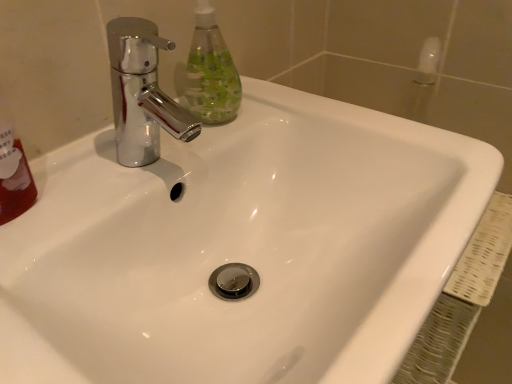
Question: Is clear plastic bottle at upper left thinner than chrome metallic faucet at upper left?

Choices:
 (A) yes
 (B) no

Answer: (A)

Question: From the image's perspective, is clear plastic bottle at upper left on chrome metallic faucet at upper left?

Choices:
 (A) yes
 (B) no

Answer: (A)

Question: Is clear plastic bottle at upper left in front of chrome metallic faucet at upper left?

Choices:
 (A) yes
 (B) no

Answer: (B)

Question: Does clear plastic bottle at upper left have a smaller size compared to chrome metallic faucet at upper left?

Choices:
 (A) no
 (B) yes

Answer: (B)

Question: From a real-world perspective, does clear plastic bottle at upper left sit lower than chrome metallic faucet at upper left?

Choices:
 (A) no
 (B) yes

Answer: (A)

Question: From the image's perspective, does clear plastic bottle at upper left appear lower than chrome metallic faucet at upper left?

Choices:
 (A) yes
 (B) no

Answer: (B)

Question: Is chrome metallic faucet at upper left further to the viewer compared to clear plastic bottle at upper left?

Choices:
 (A) no
 (B) yes

Answer: (A)

Question: Considering the relative positions of chrome metallic faucet at upper left and clear plastic bottle at upper left in the image provided, is chrome metallic faucet at upper left in front of clear plastic bottle at upper left?

Choices:
 (A) no
 (B) yes

Answer: (B)

Question: From a real-world perspective, does chrome metallic faucet at upper left stand above clear plastic bottle at upper left?

Choices:
 (A) no
 (B) yes

Answer: (A)

Question: Is chrome metallic faucet at upper left located outside clear plastic bottle at upper left?

Choices:
 (A) yes
 (B) no

Answer: (A)

Question: Does chrome metallic faucet at upper left turn towards clear plastic bottle at upper left?

Choices:
 (A) yes
 (B) no

Answer: (B)

Question: Does chrome metallic faucet at upper left have a smaller size compared to clear plastic bottle at upper left?

Choices:
 (A) yes
 (B) no

Answer: (B)

Question: Is chrome metallic faucet at upper left wider or thinner than clear plastic bottle at upper left?

Choices:
 (A) thin
 (B) wide

Answer: (B)